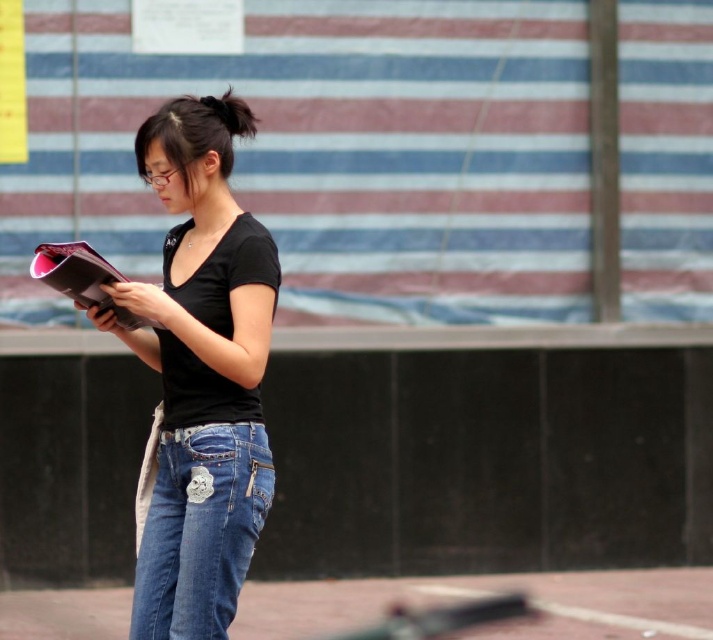
Does black matte shirt at center have a smaller size compared to denim jeans at lower center?

Incorrect, black matte shirt at center is not smaller in size than denim jeans at lower center.

The width and height of the screenshot is (713, 640). Find the location of `black matte shirt at center`. black matte shirt at center is located at coordinates (200, 372).

At what (x,y) coordinates should I click in order to perform the action: click on black matte shirt at center. Please return your answer as a coordinate pair (x, y). Image resolution: width=713 pixels, height=640 pixels. Looking at the image, I should click on (200, 372).